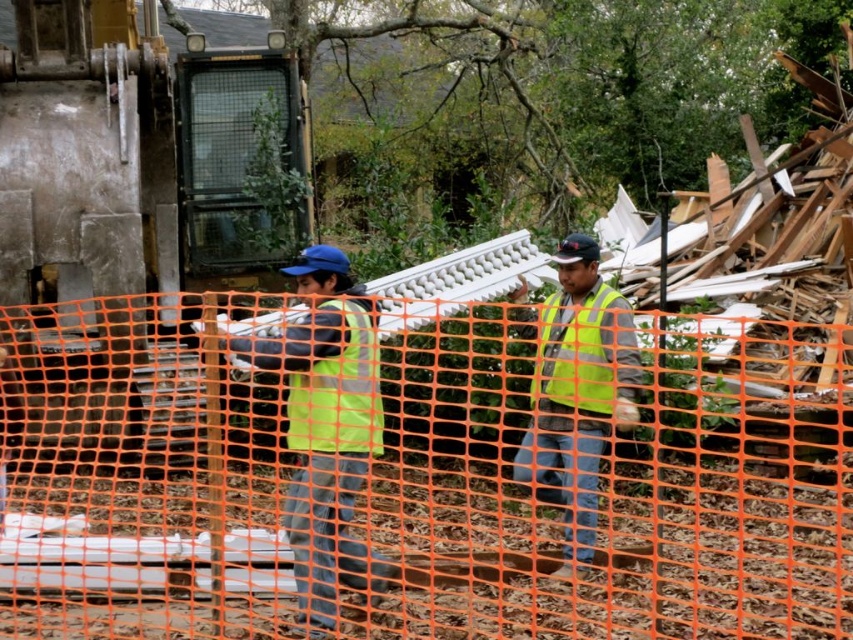
Between orange mesh fence at center and yellow reflective vest at center, which one is positioned lower?

orange mesh fence at center is below.

Between point (351, 477) and point (573, 573), which one is positioned behind?

The point (351, 477) is more distant.

Does point (71, 400) come behind point (552, 294)?

Yes.

The height and width of the screenshot is (640, 853). In order to click on orange mesh fence at center in this screenshot , I will do `click(399, 490)`.

Looking at this image, who is taller, high-visibility yellow vest at center or yellow reflective vest at center?

yellow reflective vest at center is taller.

Can you confirm if high-visibility yellow vest at center is thinner than yellow reflective vest at center?

Indeed, high-visibility yellow vest at center has a lesser width compared to yellow reflective vest at center.

Where is `high-visibility yellow vest at center`? high-visibility yellow vest at center is located at coordinates (326, 426).

Find the location of a particular element. The image size is (853, 640). high-visibility yellow vest at center is located at coordinates (326, 426).

Does high-visibility yellow safety vest at center have a larger size compared to yellow reflective safety vest at center?

Actually, high-visibility yellow safety vest at center might be smaller than yellow reflective safety vest at center.

At what (x,y) coordinates should I click in order to perform the action: click on high-visibility yellow safety vest at center. Please return your answer as a coordinate pair (x, y). Looking at the image, I should click on [339, 392].